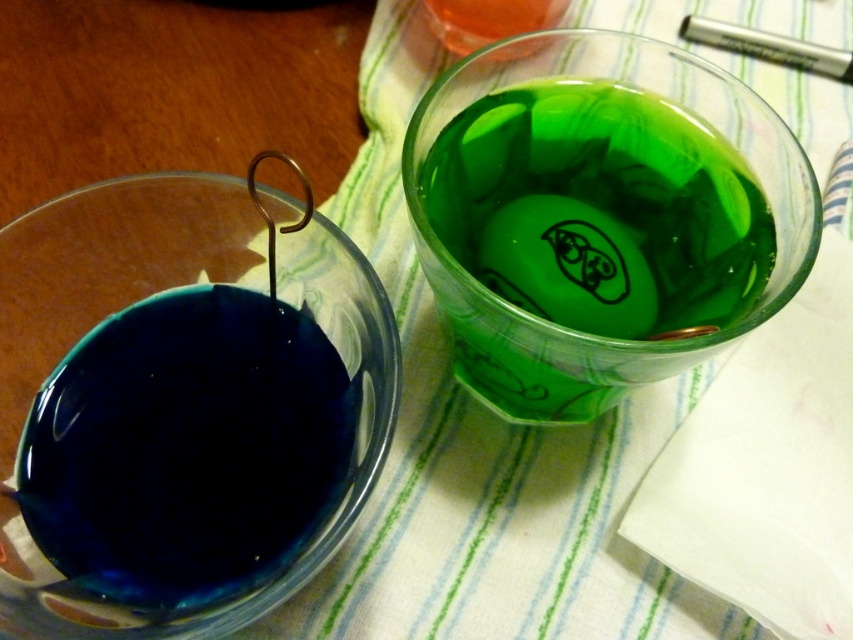
You are a bartender preparing a drink and need to place an order for ingredients. You have two items in front of you on the table. The first is the green translucent glass at upper right, and the second is the translucent orange liquid at upper center. According to their positions, which item should you list first in your order form if you want to list them from left to right?

The translucent orange liquid at upper center should be listed first because it is to the left of the green translucent glass at upper right.

You are a bartender preparing a drink and need to pour the contents of the green translucent glass at upper right into the transparent blue liquid at left. Can you do this without spilling anything?

The green translucent glass at upper right is positioned over the transparent blue liquid at left, so pouring would result in spilling since the green glass is already above the blue liquid.